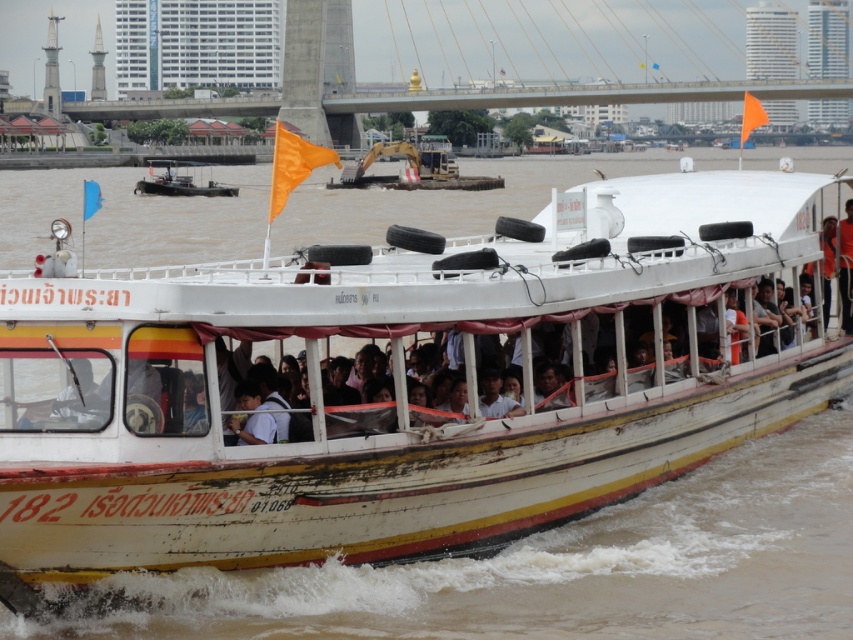
Question: Does white wooden boat at center appear under orange fabric person at center?

Choices:
 (A) yes
 (B) no

Answer: (B)

Question: Does white wooden boat at center have a lesser width compared to metallic gray boat at center?

Choices:
 (A) yes
 (B) no

Answer: (B)

Question: Among these objects, which one is nearest to the camera?

Choices:
 (A) orange fabric person at center
 (B) metallic gray boat at center
 (C) white wooden boat at center

Answer: (C)

Question: Among these points, which one is farthest from the camera?

Choices:
 (A) (752, 545)
 (B) (144, 188)
 (C) (845, 308)

Answer: (B)

Question: Is metallic gray boat at center below orange fabric person at center?

Choices:
 (A) yes
 (B) no

Answer: (B)

Question: Estimate the real-world distances between objects in this image. Which object is farther from the orange fabric person at center?

Choices:
 (A) white wooden boat at center
 (B) metallic gray boat at center

Answer: (B)